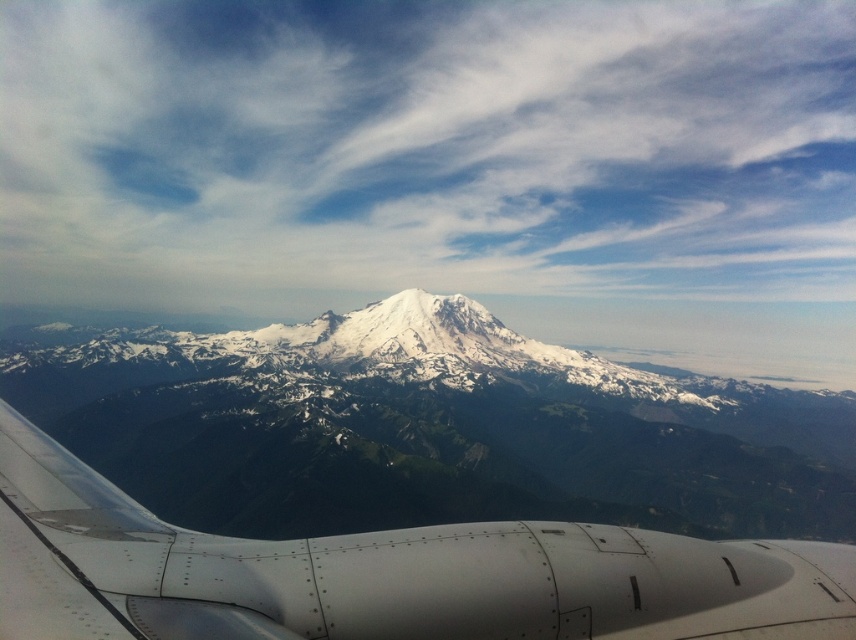
Question: Does white fluffy cloud at upper center lie in front of white metallic engine at lower left?

Choices:
 (A) no
 (B) yes

Answer: (A)

Question: Which object is closer to the camera taking this photo?

Choices:
 (A) white snow-covered mountain range at center
 (B) white fluffy cloud at upper center

Answer: (A)

Question: Which object appears closest to the camera in this image?

Choices:
 (A) white metallic engine at lower left
 (B) white fluffy cloud at upper center
 (C) white snow-covered mountain range at center

Answer: (A)

Question: Observing the image, what is the correct spatial positioning of white fluffy cloud at upper center in reference to white metallic engine at lower left?

Choices:
 (A) above
 (B) below

Answer: (A)

Question: Considering the real-world distances, which object is farthest from the white fluffy cloud at upper center?

Choices:
 (A) white snow-covered mountain range at center
 (B) white metallic engine at lower left

Answer: (B)

Question: Can you confirm if white fluffy cloud at upper center is wider than white snow-covered mountain range at center?

Choices:
 (A) no
 (B) yes

Answer: (B)